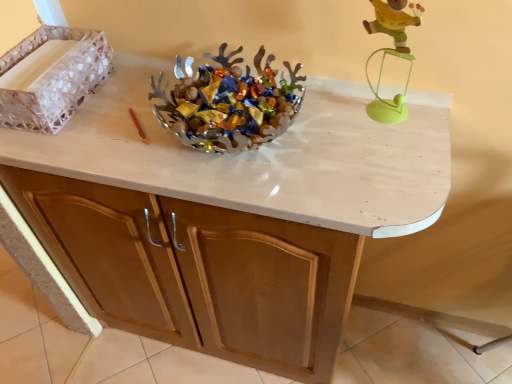
I want to click on free space in front of metallic silver bowl at center, so 256,185.